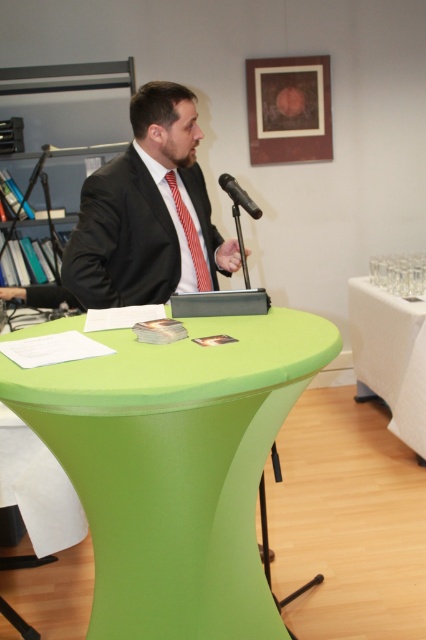
Question: Can you confirm if green matte table at center is thinner than white cloth-covered table at right?

Choices:
 (A) yes
 (B) no

Answer: (B)

Question: Among these objects, which one is nearest to the camera?

Choices:
 (A) white cloth-covered table at right
 (B) red striped tie at center
 (C) black suit at center
 (D) black metallic microphone at center

Answer: (D)

Question: Which object is closer to the camera taking this photo?

Choices:
 (A) red striped tie at center
 (B) black metallic microphone at center

Answer: (B)

Question: Observing the image, what is the correct spatial positioning of white cloth-covered table at right in reference to black metallic microphone at center?

Choices:
 (A) right
 (B) left

Answer: (A)

Question: Which point is closer to the camera?

Choices:
 (A) red striped tie at center
 (B) black suit at center
 (C) white cloth-covered table at right
 (D) green matte table at center

Answer: (D)

Question: Is black suit at center to the left of white cloth-covered table at right from the viewer's perspective?

Choices:
 (A) yes
 (B) no

Answer: (A)